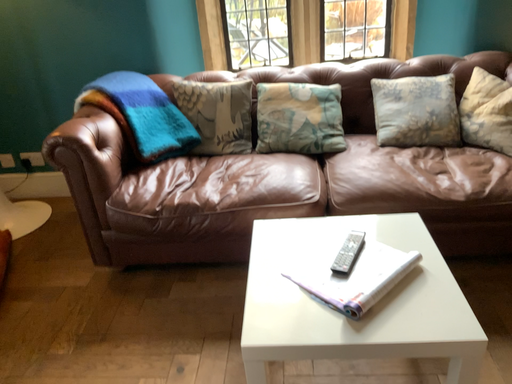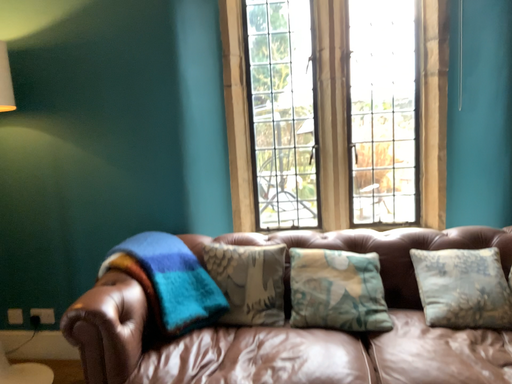
Question: Which way did the camera rotate in the video?

Choices:
 (A) rotated upward
 (B) rotated downward

Answer: (A)